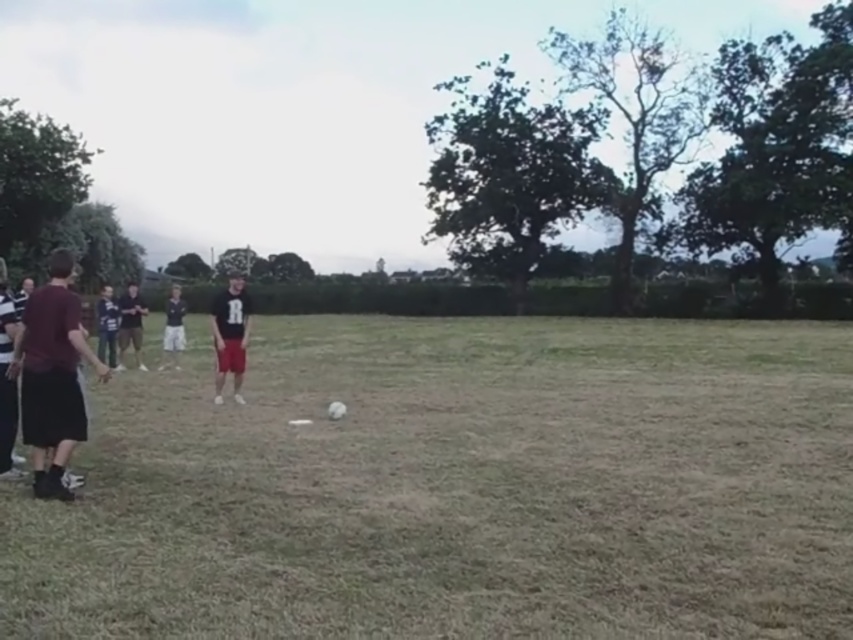
Question: Which object is farther from the camera taking this photo?

Choices:
 (A) dark blue jersey at center
 (B) dark red fabric shorts at left
 (C) dark blue sweater at left
 (D) dark gray shirt at left

Answer: (D)

Question: Does dark red fabric shorts at left appear on the left side of matte black shirt at center?

Choices:
 (A) yes
 (B) no

Answer: (A)

Question: Which of the following is the farthest from the observer?

Choices:
 (A) (102, 340)
 (B) (122, 323)
 (C) (294, 461)
 (D) (173, 324)

Answer: (D)

Question: Which point is closer to the camera taking this photo?

Choices:
 (A) (175, 337)
 (B) (273, 483)

Answer: (B)

Question: Is dark red fabric shorts at left above dark gray shirt at left?

Choices:
 (A) yes
 (B) no

Answer: (A)

Question: Can you confirm if matte black shirt at center is wider than dark blue sweater at left?

Choices:
 (A) yes
 (B) no

Answer: (A)